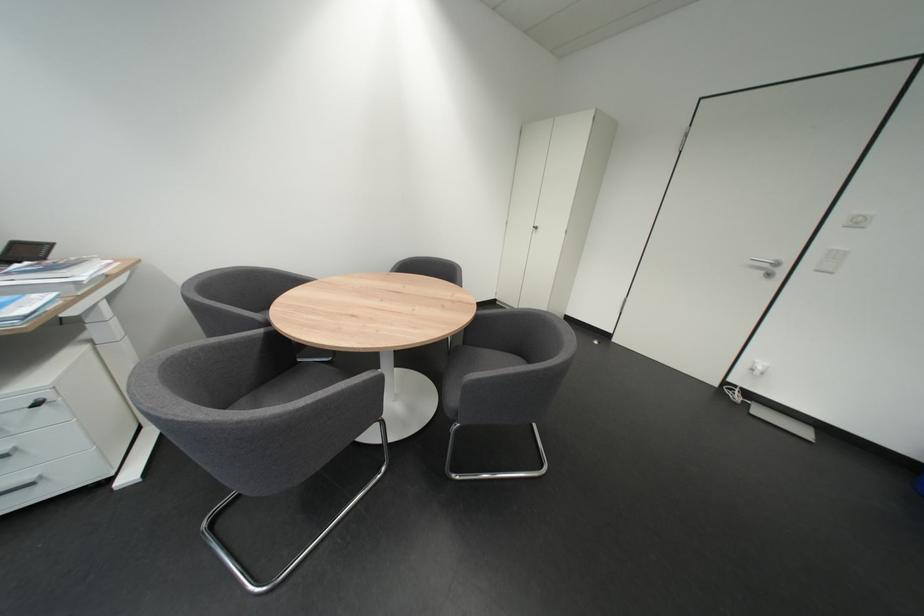
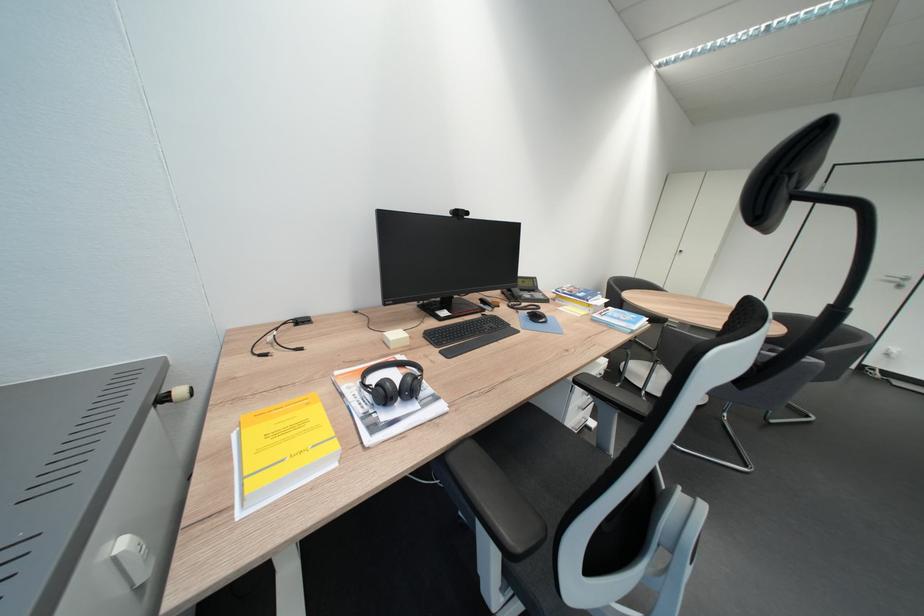
Question: In a continuous first-person perspective shot, in which direction is the camera moving?

Choices:
 (A) Left
 (B) Right
 (C) Forward
 (D) Backward

Answer: (A)